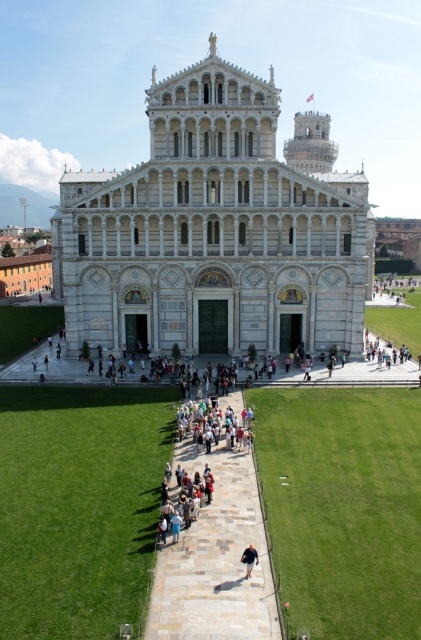
You are standing in front of the historic building and notice two groups in the foreground. The first group is the multicolored fabric crowd at center, and the second is the light blue denim jeans at lower center. Which group appears taller from your vantage point?

The multicolored fabric crowd at center appears taller than the light blue denim jeans at lower center because it has a greater height compared to the latter.

You are a photographer standing in front of the cathedral. You want to capture both the multicolored fabric crowd at center and the light brown leather shoes at center in a single shot. Which object will appear larger in your photo?

The multicolored fabric crowd at center will appear larger in the photo because it is larger in size than the light brown leather shoes at center.

You are standing in front of the grand historic building and see the multicolored fabric crowd at center and the light brown leather shoes at center. Which object is higher up?

The multicolored fabric crowd at center is taller than the light brown leather shoes at center.